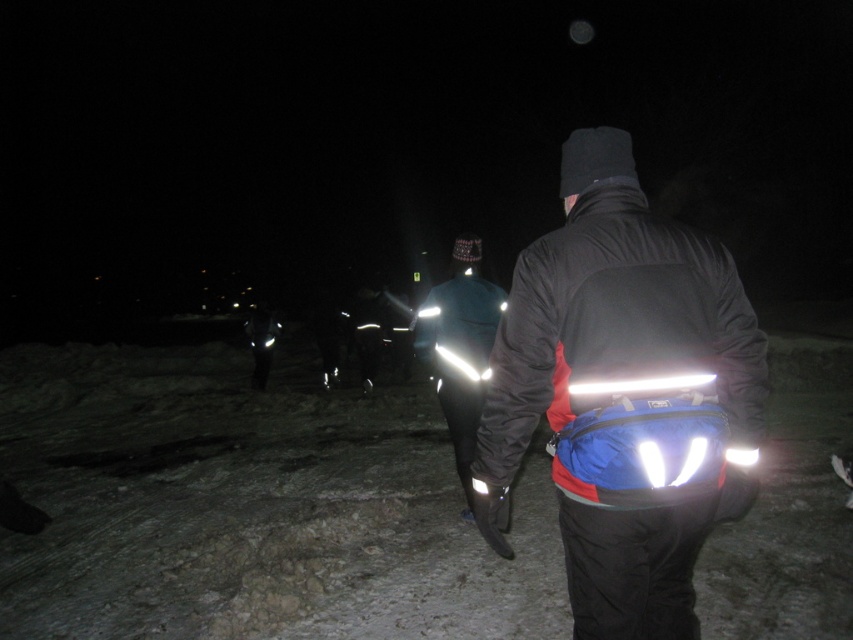
Who is shorter, white matte snow at center or reflective fabric jacket at center?

white matte snow at center is shorter.

Can you confirm if white matte snow at center is taller than reflective fabric jacket at center?

In fact, white matte snow at center may be shorter than reflective fabric jacket at center.

Which is in front, point (254, 545) or point (495, 308)?

Point (254, 545)

At what (x,y) coordinates should I click in order to perform the action: click on white matte snow at center. Please return your answer as a coordinate pair (x, y). The image size is (853, 640). Looking at the image, I should click on pos(250,506).

Image resolution: width=853 pixels, height=640 pixels. What do you see at coordinates (616, 324) in the screenshot?
I see `black matte jacket at center` at bounding box center [616, 324].

Which is behind, point (701, 342) or point (473, 384)?

The point (473, 384) is more distant.

Does point (637, 368) lie in front of point (454, 285)?

Yes.

Where is `black matte jacket at center`? black matte jacket at center is located at coordinates (616, 324).

Does black matte jacket at center have a greater height compared to glossy reflective jacket at center?

Yes.

Does black matte jacket at center have a lesser width compared to glossy reflective jacket at center?

No.

Which is behind, point (614, 216) or point (436, 339)?

The point (436, 339) is behind.

Locate an element on the screen. Image resolution: width=853 pixels, height=640 pixels. black matte jacket at center is located at coordinates (616, 324).